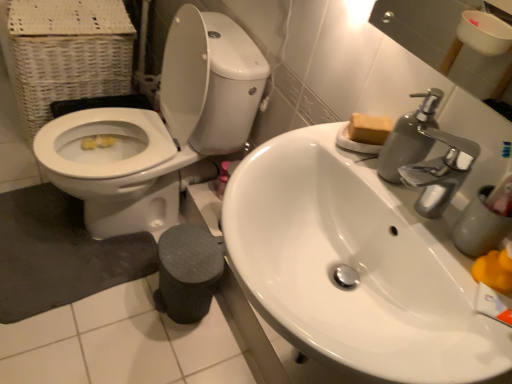
Question: From a real-world perspective, is white wicker basket at left below metallic gray soap dispenser at upper right?

Choices:
 (A) yes
 (B) no

Answer: (A)

Question: From the image's perspective, is white wicker basket at left on metallic gray soap dispenser at upper right?

Choices:
 (A) yes
 (B) no

Answer: (A)

Question: Is metallic gray soap dispenser at upper right at the back of white wicker basket at left?

Choices:
 (A) yes
 (B) no

Answer: (B)

Question: Is white wicker basket at left closer to the viewer compared to metallic gray soap dispenser at upper right?

Choices:
 (A) no
 (B) yes

Answer: (A)

Question: Would you say white wicker basket at left is outside metallic gray soap dispenser at upper right?

Choices:
 (A) yes
 (B) no

Answer: (A)

Question: Visually, is metallic gray soap dispenser at upper right positioned to the left or to the right of yellow plastic toy at sink right?

Choices:
 (A) left
 (B) right

Answer: (A)

Question: From the image's perspective, is metallic gray soap dispenser at upper right above or below yellow plastic toy at sink right?

Choices:
 (A) below
 (B) above

Answer: (B)

Question: Choose the correct answer: Is metallic gray soap dispenser at upper right inside yellow plastic toy at sink right or outside it?

Choices:
 (A) inside
 (B) outside

Answer: (B)

Question: Relative to yellow plastic toy at sink right, is metallic gray soap dispenser at upper right in front or behind?

Choices:
 (A) front
 (B) behind

Answer: (B)

Question: In terms of height, does white wicker basket at left look taller or shorter compared to white glossy sink at upper right?

Choices:
 (A) tall
 (B) short

Answer: (A)

Question: Considering their positions, is white wicker basket at left located in front of or behind white glossy sink at upper right?

Choices:
 (A) behind
 (B) front

Answer: (A)

Question: From the image's perspective, is white wicker basket at left located above or below white glossy sink at upper right?

Choices:
 (A) above
 (B) below

Answer: (A)

Question: In terms of width, does white wicker basket at left look wider or thinner when compared to white glossy sink at upper right?

Choices:
 (A) wide
 (B) thin

Answer: (A)

Question: Looking at the image, does yellow plastic toy at sink right seem bigger or smaller compared to white glossy toilet at left?

Choices:
 (A) small
 (B) big

Answer: (A)

Question: From the image's perspective, is yellow plastic toy at sink right above or below white glossy toilet at left?

Choices:
 (A) above
 (B) below

Answer: (B)